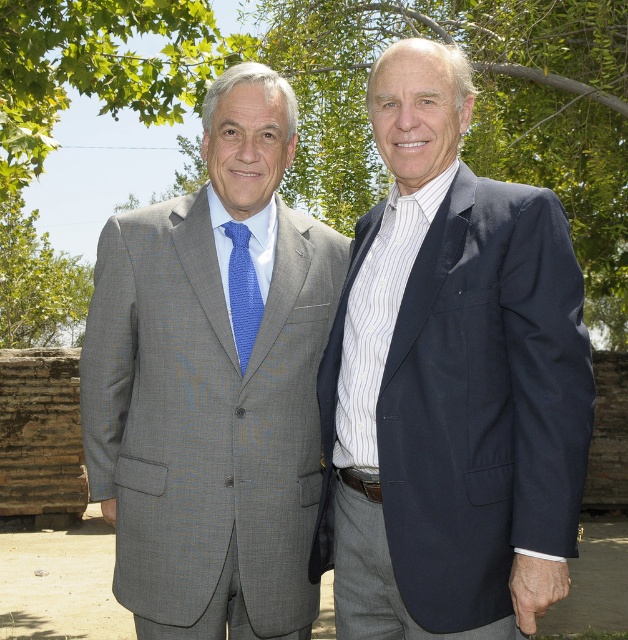
Question: Is navy wool suit at right wider than green leafy tree at upper left?

Choices:
 (A) no
 (B) yes

Answer: (B)

Question: Among these objects, which one is nearest to the camera?

Choices:
 (A) navy wool suit at right
 (B) blue textured tie at center
 (C) green leafy tree at upper center
 (D) gray textured suit at center

Answer: (A)

Question: Which object is closer to the camera taking this photo?

Choices:
 (A) green leafy tree at upper left
 (B) blue textured tie at center
 (C) navy wool suit at right
 (D) gray textured suit at center

Answer: (C)

Question: Does navy wool suit at right lie behind blue textured tie at center?

Choices:
 (A) yes
 (B) no

Answer: (B)

Question: Which object is the closest to the navy wool suit at right?

Choices:
 (A) green leafy tree at upper left
 (B) gray textured suit at center
 (C) green leafy tree at upper center

Answer: (B)

Question: Is navy wool suit at right positioned behind blue textured tie at center?

Choices:
 (A) yes
 (B) no

Answer: (B)